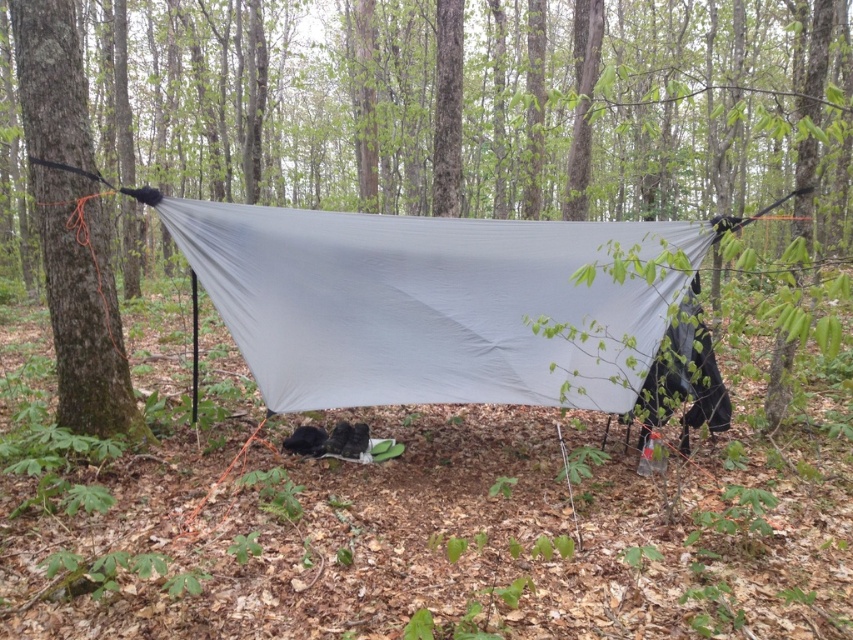
Question: Which object is the farthest from the green matte tarp at center?

Choices:
 (A) smooth bark tree at left
 (B) matte gray tarp at center

Answer: (A)

Question: Does green matte tarp at center have a lesser width compared to matte gray tarp at center?

Choices:
 (A) yes
 (B) no

Answer: (B)

Question: Can you confirm if green matte tarp at center is smaller than matte gray tarp at center?

Choices:
 (A) yes
 (B) no

Answer: (B)

Question: Which of the following is the farthest from the observer?

Choices:
 (A) pyautogui.click(x=538, y=364)
 (B) pyautogui.click(x=126, y=428)
 (C) pyautogui.click(x=509, y=173)

Answer: (C)

Question: Does green matte tarp at center appear under matte gray tarp at center?

Choices:
 (A) yes
 (B) no

Answer: (B)

Question: Which point is closer to the camera?

Choices:
 (A) (79, 305)
 (B) (543, 195)

Answer: (A)